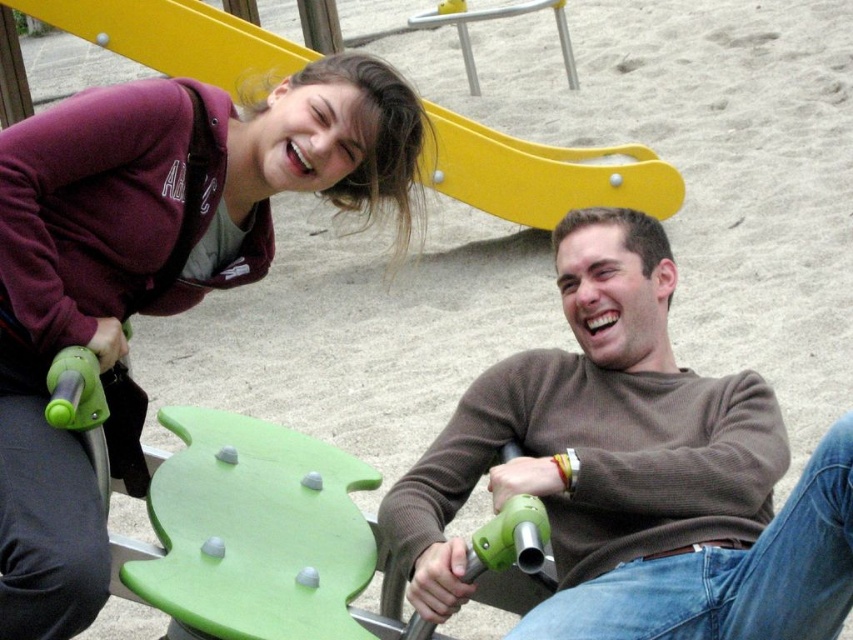
Question: Can you confirm if brown textured sweater at center is positioned to the right of maroon fleece jacket at upper left?

Choices:
 (A) no
 (B) yes

Answer: (B)

Question: Does brown textured sweater at center have a larger size compared to yellow matte slide at upper center?

Choices:
 (A) no
 (B) yes

Answer: (B)

Question: Which of the following is the closest to the observer?

Choices:
 (A) (129, 464)
 (B) (735, 508)
 (C) (518, 170)

Answer: (B)

Question: Does maroon fleece jacket at upper left have a larger size compared to yellow matte slide at upper center?

Choices:
 (A) no
 (B) yes

Answer: (B)

Question: Which point appears closest to the camera in this image?

Choices:
 (A) (131, 131)
 (B) (740, 609)
 (C) (440, 157)

Answer: (B)

Question: Which object is farther from the camera taking this photo?

Choices:
 (A) maroon fleece jacket at upper left
 (B) yellow matte slide at upper center

Answer: (B)